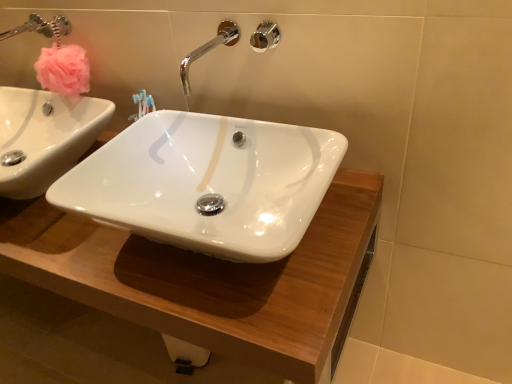
Question: From a real-world perspective, is white glossy wood counter top at center physically located above or below polished chrome shower at upper center?

Choices:
 (A) above
 (B) below

Answer: (B)

Question: Choose the correct answer: Is white glossy wood counter top at center inside polished chrome shower at upper center or outside it?

Choices:
 (A) outside
 (B) inside

Answer: (A)

Question: Estimate the real-world distances between objects in this image. Which object is farther from the white glossy wood counter top at center?

Choices:
 (A) polished chrome shower at upper center
 (B) chrome/metallic faucet at upper center

Answer: (A)

Question: Estimate the real-world distances between objects in this image. Which object is farther from the white glossy wood counter top at center?

Choices:
 (A) chrome/metallic faucet at upper center
 (B) polished chrome shower at upper center

Answer: (B)